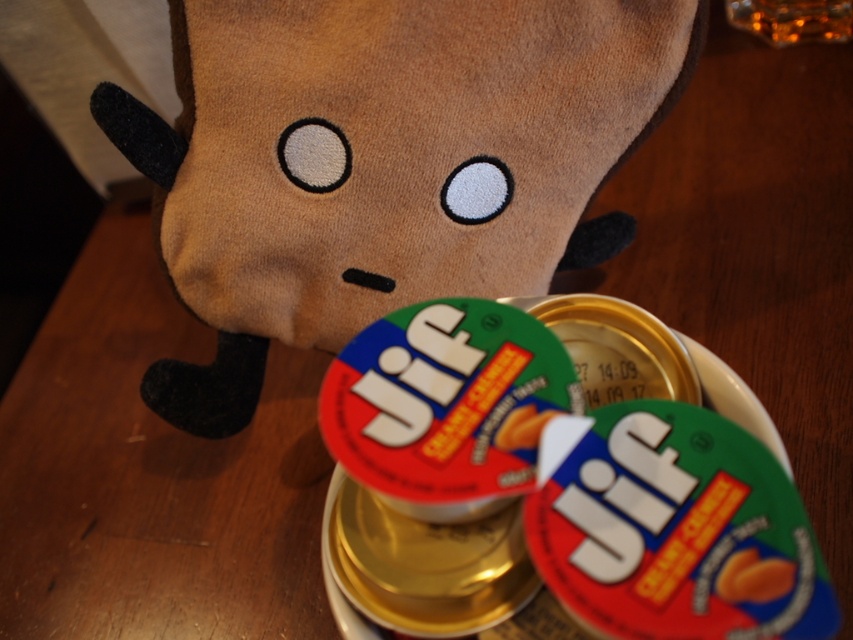
You are a robotic arm trying to pick up the Jif creamy peanut butter jars. You need to determine which jar is closer to you. The two jars are represented by the points at coordinates point (457, 259) and point (519, 440). Which point corresponds to the jar that is closer to you?

Point (519, 440) is closer to you because the description states that point (457, 259) is further to the camera than point (519, 440).